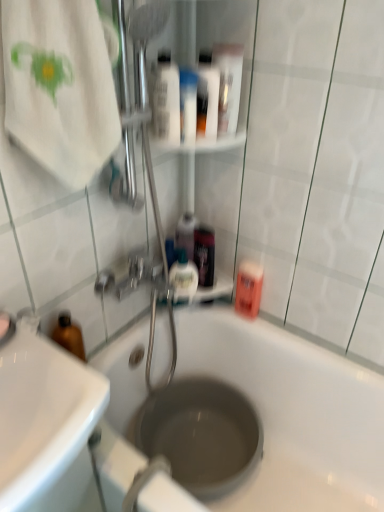
In order to face white glossy sink at lower left, should I rotate leftwards or rightwards?

You should rotate left by 22.655 degrees.

Describe the element at coordinates (166, 98) in the screenshot. I see `translucent plastic mouthwash at upper center, which ranks as the 5th mouthwash in bottom-to-top order` at that location.

Identify the location of translucent plastic mouthwash at upper center, which appears as the second mouthwash when ordered from the bottom. (183, 277).

Describe the element at coordinates (201, 434) in the screenshot. The image size is (384, 512). I see `transparent plastic hole at center` at that location.

This screenshot has height=512, width=384. What do you see at coordinates (228, 84) in the screenshot?
I see `white glossy mouthwash at upper center, the 7th mouthwash when ordered from bottom to top` at bounding box center [228, 84].

What do you see at coordinates (207, 95) in the screenshot? The width and height of the screenshot is (384, 512). I see `white glossy mouthwash at upper center, which ranks as the 6th mouthwash in bottom-to-top order` at bounding box center [207, 95].

The height and width of the screenshot is (512, 384). In order to click on pink matte mouthwash at right, marked as the 1th mouthwash in a bottom-to-top arrangement in this screenshot , I will do `click(248, 289)`.

You are a GUI agent. You are given a task and a screenshot of the screen. Output one action in this format:
    pyautogui.click(x=<x>, y=<y>)
    Task: Click on the 5th mouthwash above the transparent plastic hole at center (from the image's perspective)
    The width and height of the screenshot is (384, 512).
    Given the screenshot: What is the action you would take?
    pyautogui.click(x=166, y=98)

Does point (174, 136) appear closer or farther from the camera than point (202, 416)?

Point (174, 136) is closer to the camera than point (202, 416).

Is white glossy tube at upper center in contact with white glossy sink at lower left?

No, white glossy tube at upper center is not next to white glossy sink at lower left.

Does point (187, 124) lie behind point (20, 509)?

Yes, point (187, 124) is farther from viewer.

Between white glossy tube at upper center and white glossy sink at lower left, which one has larger size?

white glossy sink at lower left is bigger.

Could you tell me if white glossy mouthwash at upper center, the 7th mouthwash when ordered from bottom to top, is facing translucent plastic mouthwash at upper center, the third mouthwash in the bottom-to-top sequence?

No.

Who is shorter, white glossy mouthwash at upper center, the 7th mouthwash when ordered from bottom to top, or translucent plastic mouthwash at upper center, the third mouthwash in the bottom-to-top sequence?

translucent plastic mouthwash at upper center, the third mouthwash in the bottom-to-top sequence, is shorter.

Measure the distance between white glossy mouthwash at upper center, which appears as the first mouthwash when viewed from the top, and translucent plastic mouthwash at upper center, which appears as the fifth mouthwash when viewed from the top.

A distance of 16.65 inches exists between white glossy mouthwash at upper center, which appears as the first mouthwash when viewed from the top, and translucent plastic mouthwash at upper center, which appears as the fifth mouthwash when viewed from the top.

Looking at this image, is the surface of white glossy mouthwash at upper center, which appears as the first mouthwash when viewed from the top, in direct contact with translucent plastic mouthwash at upper center, the third mouthwash in the bottom-to-top sequence?

white glossy mouthwash at upper center, which appears as the first mouthwash when viewed from the top, and translucent plastic mouthwash at upper center, the third mouthwash in the bottom-to-top sequence, are not in contact.

Considering the points (240, 279) and (217, 59), which point is in front, point (240, 279) or point (217, 59)?

The point (217, 59) is closer to the camera.

Is pink matte mouthwash at right, the 7th mouthwash viewed from the top, directly adjacent to white glossy mouthwash at upper center, which appears as the first mouthwash when viewed from the top?

pink matte mouthwash at right, the 7th mouthwash viewed from the top, and white glossy mouthwash at upper center, which appears as the first mouthwash when viewed from the top, are clearly separated.

From the image's perspective, which mouthwash is the 6th one above the pink matte mouthwash at right, the 7th mouthwash viewed from the top? Please provide its 2D coordinates.

[(228, 84)]

From the image's perspective, is pink matte mouthwash at right, marked as the 1th mouthwash in a bottom-to-top arrangement, on white glossy mouthwash at upper center, which appears as the first mouthwash when viewed from the top?

No, from the image's perspective, pink matte mouthwash at right, marked as the 1th mouthwash in a bottom-to-top arrangement, is not above white glossy mouthwash at upper center, which appears as the first mouthwash when viewed from the top.

From the image's perspective, between white glossy tube at upper center and white cotton towel at upper left, who is located below?

white cotton towel at upper left is shown below in the image.

Is white glossy tube at upper center next to white cotton towel at upper left?

white glossy tube at upper center is not next to white cotton towel at upper left, and they're not touching.

Can you confirm if white glossy tube at upper center is wider than white cotton towel at upper left?

Incorrect, the width of white glossy tube at upper center does not surpass that of white cotton towel at upper left.

Based on the photo, considering their positions, is white glossy tube at upper center located in front of or behind white cotton towel at upper left?

Clearly, white glossy tube at upper center is behind white cotton towel at upper left.

Is point (182, 106) farther from viewer compared to point (178, 96)?

Yes, it is.

In terms of width, does white glossy tube at upper center look wider or thinner when compared to translucent plastic mouthwash at upper center, arranged as the 3th mouthwash when viewed from the top?

Clearly, white glossy tube at upper center has less width compared to translucent plastic mouthwash at upper center, arranged as the 3th mouthwash when viewed from the top.

From a real-world perspective, which object stands above the other?

From a 3D spatial view, translucent plastic mouthwash at upper center, arranged as the 3th mouthwash when viewed from the top, is above.

How distant is white glossy tube at upper center from translucent plastic mouthwash at upper center, which ranks as the 5th mouthwash in bottom-to-top order?

white glossy tube at upper center is 1.39 inches from translucent plastic mouthwash at upper center, which ranks as the 5th mouthwash in bottom-to-top order.

Considering the sizes of objects translucent plastic mouthwash at center, placed as the fourth mouthwash when sorted from top to bottom, and white cotton towel at upper left in the image provided, who is wider, translucent plastic mouthwash at center, placed as the fourth mouthwash when sorted from top to bottom, or white cotton towel at upper left?

Wider between the two is white cotton towel at upper left.

In the image, is translucent plastic mouthwash at center, placed as the fourth mouthwash when sorted from top to bottom, positioned in front of or behind white cotton towel at upper left?

Clearly, translucent plastic mouthwash at center, placed as the fourth mouthwash when sorted from top to bottom, is behind white cotton towel at upper left.

In terms of height, does translucent plastic mouthwash at center, placed as the fourth mouthwash when sorted from top to bottom, look taller or shorter compared to white cotton towel at upper left?

Clearly, translucent plastic mouthwash at center, placed as the fourth mouthwash when sorted from top to bottom, is shorter compared to white cotton towel at upper left.

Find the location of a particular element. the 3rd mouthwash to the left of the transparent plastic hole at center, counting from the anchor's position is located at coordinates (166, 98).

In order to click on sink below the white glossy tube at upper center (from the image's perspective) in this screenshot , I will do (43, 414).

Looking at the image, which one is located closer to white glossy tube at upper center, white cotton towel at upper left or transparent plastic hole at center?

white cotton towel at upper left is closer to white glossy tube at upper center.

When comparing their distances from pink matte mouthwash at right, the 7th mouthwash viewed from the top, does white glossy tube at upper center or translucent plastic mouthwash at upper center, which appears as the second mouthwash when ordered from the bottom, seem further?

Based on the image, white glossy tube at upper center appears to be further to pink matte mouthwash at right, the 7th mouthwash viewed from the top.

Considering their positions, is translucent plastic mouthwash at upper center, which appears as the fifth mouthwash when viewed from the top, positioned further to transparent plastic hole at center than white glossy tube at upper center?

white glossy tube at upper center is further to transparent plastic hole at center.

Looking at this image, looking at the image, which one is located closer to translucent plastic mouthwash at upper center, the third mouthwash in the bottom-to-top sequence, translucent plastic mouthwash at center, placed as the fourth mouthwash when sorted from top to bottom, or white glossy tube at upper center?

translucent plastic mouthwash at center, placed as the fourth mouthwash when sorted from top to bottom, lies closer to translucent plastic mouthwash at upper center, the third mouthwash in the bottom-to-top sequence, than the other object.

When comparing their distances from translucent plastic mouthwash at upper center, which appears as the sixth mouthwash when viewed from the top, does white glossy mouthwash at upper center, the 7th mouthwash when ordered from bottom to top, or transparent plastic hole at center seem closer?

transparent plastic hole at center is positioned closer to the anchor translucent plastic mouthwash at upper center, which appears as the sixth mouthwash when viewed from the top.

Considering their positions, is translucent plastic mouthwash at upper center, arranged as the 3th mouthwash when viewed from the top, positioned closer to white cotton towel at upper left than pink matte mouthwash at right, marked as the 1th mouthwash in a bottom-to-top arrangement?

The object closer to white cotton towel at upper left is translucent plastic mouthwash at upper center, arranged as the 3th mouthwash when viewed from the top.

When comparing their distances from white glossy sink at lower left, does white cotton towel at upper left or white glossy mouthwash at upper center, which is the 2th mouthwash in top-to-bottom order, seem closer?

Based on the image, white cotton towel at upper left appears to be nearer to white glossy sink at lower left.

Estimate the real-world distances between objects in this image. Which object is further from white glossy sink at lower left, white glossy tube at upper center or white glossy mouthwash at upper center, which is the 2th mouthwash in top-to-bottom order?

white glossy mouthwash at upper center, which is the 2th mouthwash in top-to-bottom order, is further to white glossy sink at lower left.

This screenshot has height=512, width=384. Find the location of `mouthwash between translucent plastic mouthwash at center, acting as the fourth mouthwash starting from the bottom, and translucent plastic mouthwash at upper center, which appears as the second mouthwash when ordered from the bottom, in the vertical direction`. mouthwash between translucent plastic mouthwash at center, acting as the fourth mouthwash starting from the bottom, and translucent plastic mouthwash at upper center, which appears as the second mouthwash when ordered from the bottom, in the vertical direction is located at coordinates (204, 254).

Where is `toiletry that lies between translucent plastic mouthwash at upper center, which ranks as the 5th mouthwash in bottom-to-top order, and pink matte mouthwash at right, the 7th mouthwash viewed from the top, from top to bottom`? Image resolution: width=384 pixels, height=512 pixels. toiletry that lies between translucent plastic mouthwash at upper center, which ranks as the 5th mouthwash in bottom-to-top order, and pink matte mouthwash at right, the 7th mouthwash viewed from the top, from top to bottom is located at coordinates (188, 104).

This screenshot has width=384, height=512. Identify the location of toiletry between translucent plastic mouthwash at upper center, arranged as the 3th mouthwash when viewed from the top, and white glossy sink at lower left from top to bottom. (188, 104).

You are a GUI agent. You are given a task and a screenshot of the screen. Output one action in this format:
    pyautogui.click(x=<x>, y=<y>)
    Task: Click on the toiletry between white glossy mouthwash at upper center, which ranks as the 6th mouthwash in bottom-to-top order, and translucent plastic mouthwash at upper center, the third mouthwash in the bottom-to-top sequence, vertically
    The height and width of the screenshot is (512, 384).
    Given the screenshot: What is the action you would take?
    pyautogui.click(x=188, y=104)